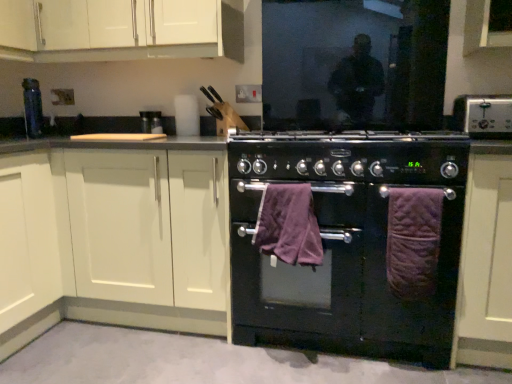
Question: Is matte black knife block at upper center, positioned as the first appliance in top-to-bottom order, surrounded by purple quilted bath towel at right, which is the first bath towel in right-to-left order?

Choices:
 (A) no
 (B) yes

Answer: (A)

Question: Can you confirm if purple quilted bath towel at right, which is the first bath towel in right-to-left order, is taller than matte black knife block at upper center, positioned as the first appliance in top-to-bottom order?

Choices:
 (A) yes
 (B) no

Answer: (A)

Question: Does purple quilted bath towel at right, which is the first bath towel in right-to-left order, have a greater width compared to matte black knife block at upper center, acting as the second appliance starting from the front?

Choices:
 (A) no
 (B) yes

Answer: (A)

Question: Does purple quilted bath towel at right, which is the first bath towel in right-to-left order, come behind matte black knife block at upper center, marked as the first appliance in a left-to-right arrangement?

Choices:
 (A) no
 (B) yes

Answer: (A)

Question: Could you tell me if purple quilted bath towel at right, which is the first bath towel in right-to-left order, is turned towards matte black knife block at upper center, the 1th appliance when ordered from back to front?

Choices:
 (A) yes
 (B) no

Answer: (B)

Question: From a real-world perspective, is purple quilted bath towel at right, which is the first bath towel in right-to-left order, on matte black knife block at upper center, the 2th appliance when ordered from right to left?

Choices:
 (A) no
 (B) yes

Answer: (A)

Question: From the image's perspective, is purple quilted bath towel at right, acting as the second bath towel starting from the left, on white matte cabinet at upper left, arranged as the 2th cabinetry when viewed from the right?

Choices:
 (A) yes
 (B) no

Answer: (B)

Question: Considering the relative positions of purple quilted bath towel at right, which is the first bath towel in right-to-left order, and white matte cabinet at upper left, arranged as the 2th cabinetry when viewed from the right, in the image provided, is purple quilted bath towel at right, which is the first bath towel in right-to-left order, in front of white matte cabinet at upper left, arranged as the 2th cabinetry when viewed from the right,?

Choices:
 (A) yes
 (B) no

Answer: (A)

Question: Considering the relative sizes of purple quilted bath towel at right, acting as the second bath towel starting from the left, and white matte cabinet at upper left, arranged as the 2th cabinetry when viewed from the left, in the image provided, is purple quilted bath towel at right, acting as the second bath towel starting from the left, bigger than white matte cabinet at upper left, arranged as the 2th cabinetry when viewed from the left,?

Choices:
 (A) yes
 (B) no

Answer: (B)

Question: Does purple quilted bath towel at right, acting as the second bath towel starting from the left, have a smaller size compared to white matte cabinet at upper left, arranged as the 2th cabinetry when viewed from the left?

Choices:
 (A) no
 (B) yes

Answer: (B)

Question: From a real-world perspective, is purple quilted bath towel at right, acting as the second bath towel starting from the left, beneath white matte cabinet at upper left, arranged as the 2th cabinetry when viewed from the right?

Choices:
 (A) yes
 (B) no

Answer: (A)

Question: Can you confirm if purple quilted bath towel at right, acting as the second bath towel starting from the left, is positioned to the right of white matte cabinet at upper left, arranged as the 2th cabinetry when viewed from the right?

Choices:
 (A) yes
 (B) no

Answer: (A)

Question: Does purple plush bath towel at center, which appears as the second bath towel when viewed from the right, lie behind white matte cabinet at upper left, arranged as the 2th cabinetry when viewed from the right?

Choices:
 (A) no
 (B) yes

Answer: (A)